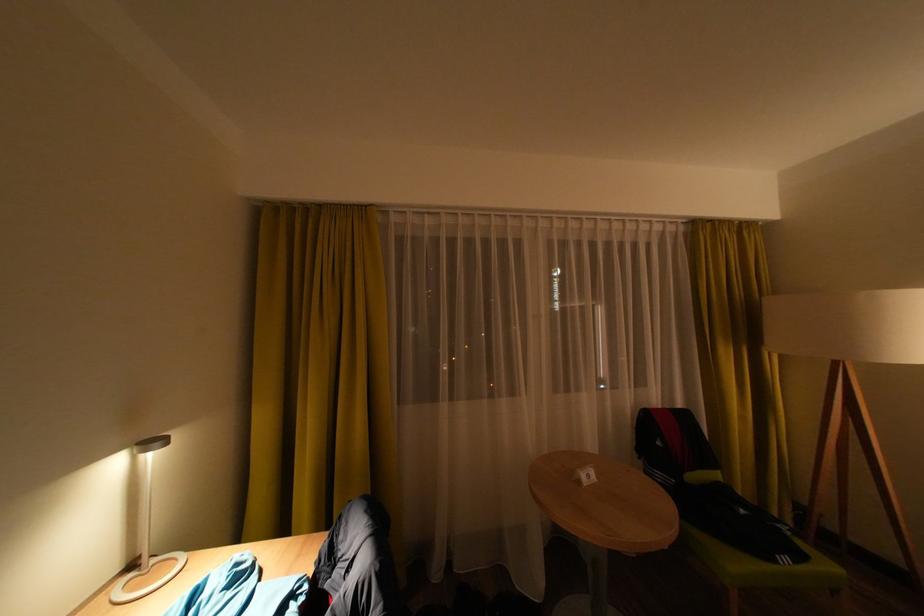
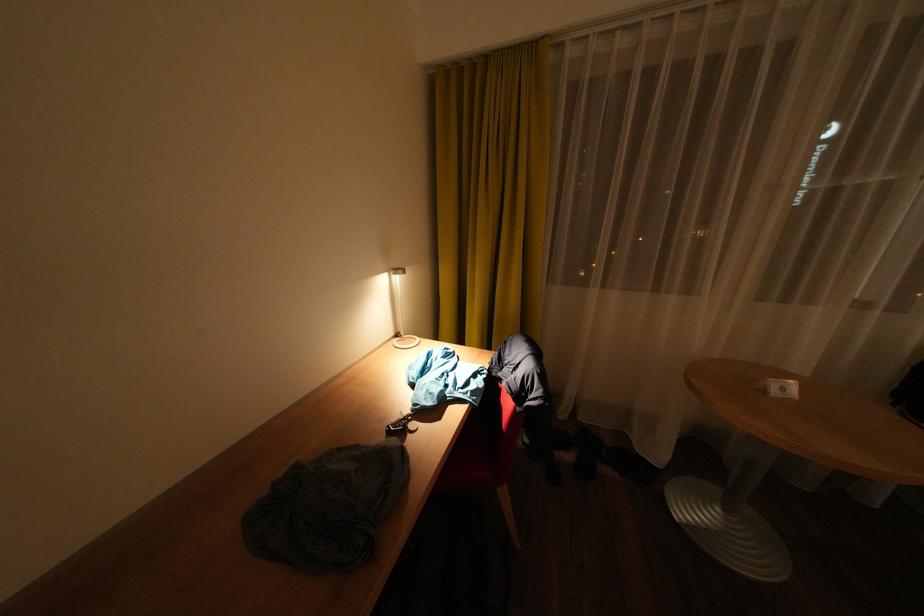
Find the pixel in the second image that matches point (140, 567) in the first image.

(407, 336)